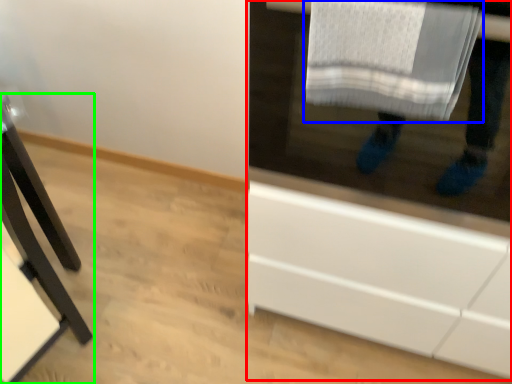
Question: Which object is positioned farthest from cabinetry (highlighted by a red box)? Select from bath towel (highlighted by a blue box) and furniture (highlighted by a green box).

Choices:
 (A) bath towel
 (B) furniture

Answer: (B)